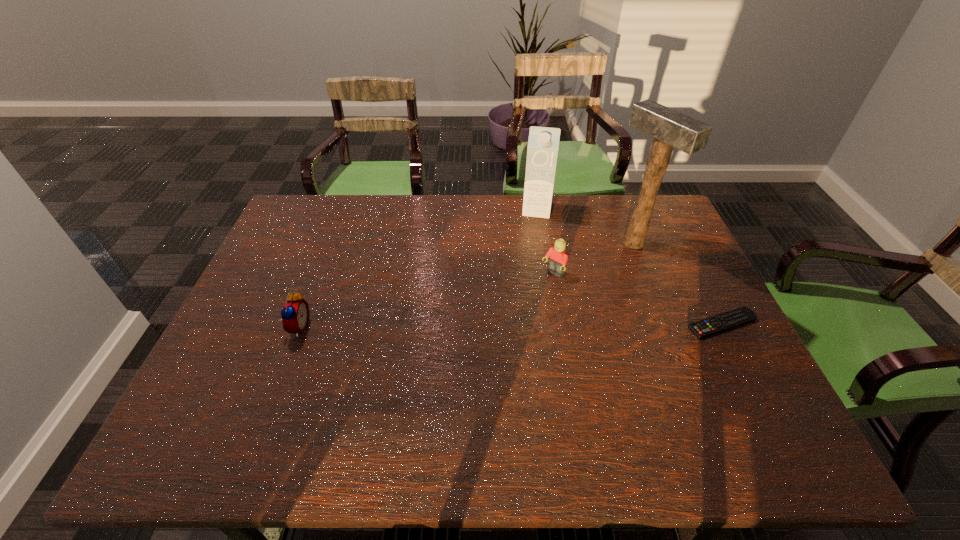
Where is `free location located 0.310m on the front label of the farthest object`? The height and width of the screenshot is (540, 960). free location located 0.310m on the front label of the farthest object is located at coordinates (527, 282).

The height and width of the screenshot is (540, 960). I want to click on vacant space situated on the front label of the farthest object, so click(x=526, y=289).

Where is `vacant point located on the striking surface of the mallet`? The image size is (960, 540). vacant point located on the striking surface of the mallet is located at coordinates (533, 298).

The width and height of the screenshot is (960, 540). I want to click on free location located 0.320m on the striking surface of the mallet, so click(x=535, y=296).

Locate an element on the screen. This screenshot has height=540, width=960. vacant space located on the striking surface of the mallet is located at coordinates (583, 272).

Locate an element on the screen. The height and width of the screenshot is (540, 960). vacant space located 0.380m on the face of the Lego is located at coordinates (459, 364).

I want to click on vacant position located on the face of the Lego, so click(495, 330).

The height and width of the screenshot is (540, 960). I want to click on vacant space located 0.090m on the face of the Lego, so click(x=529, y=298).

At what (x,y) coordinates should I click in order to perform the action: click on carton situated at the far edge. Please return your answer as a coordinate pair (x, y). Image resolution: width=960 pixels, height=540 pixels. Looking at the image, I should click on click(543, 144).

You are a GUI agent. You are given a task and a screenshot of the screen. Output one action in this format:
    pyautogui.click(x=<x>, y=<y>)
    Task: Click on the mallet that is at the far edge
    This screenshot has height=540, width=960.
    Given the screenshot: What is the action you would take?
    pyautogui.click(x=670, y=128)